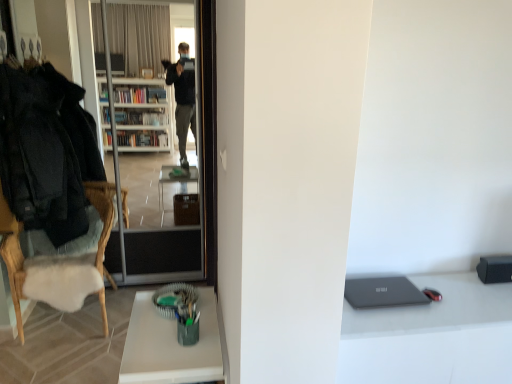
This screenshot has height=384, width=512. What are the coordinates of `free space to the right of matte gray laptop at lower right` in the screenshot? It's located at (445, 301).